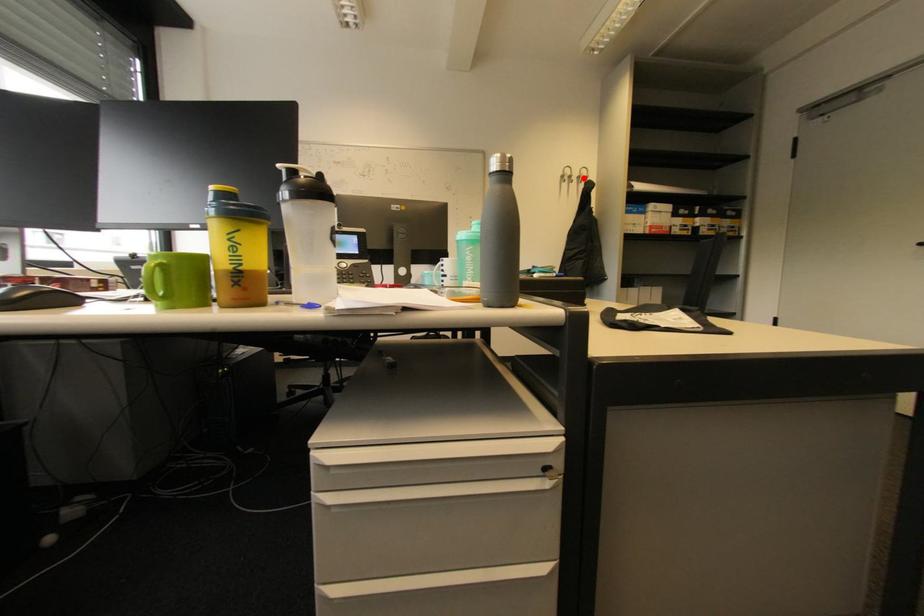
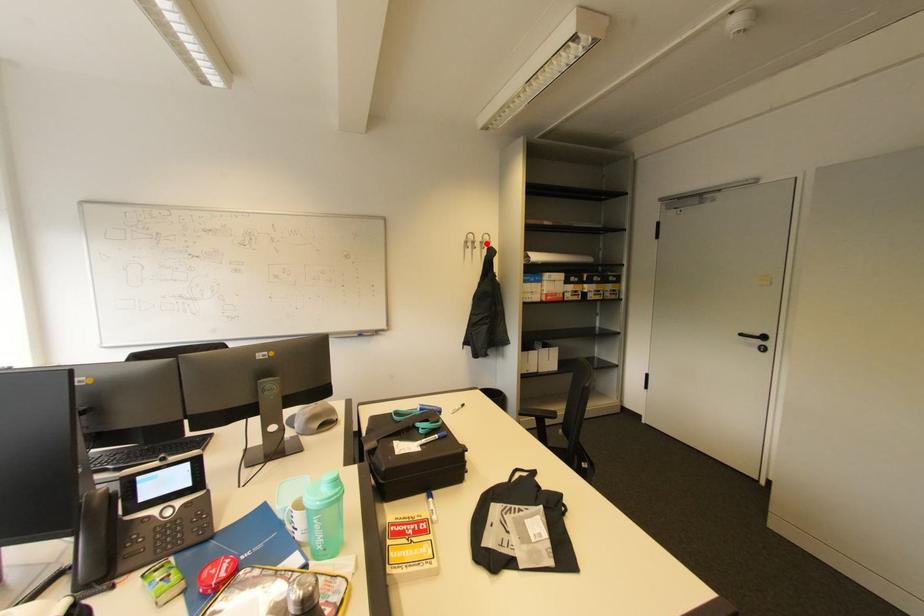
I am providing you with two images of the same scene from different viewpoints. A red point is marked on the first image and another point is marked on the second image. Is the red point in image1 aligned with the point shown in image2?

Yes